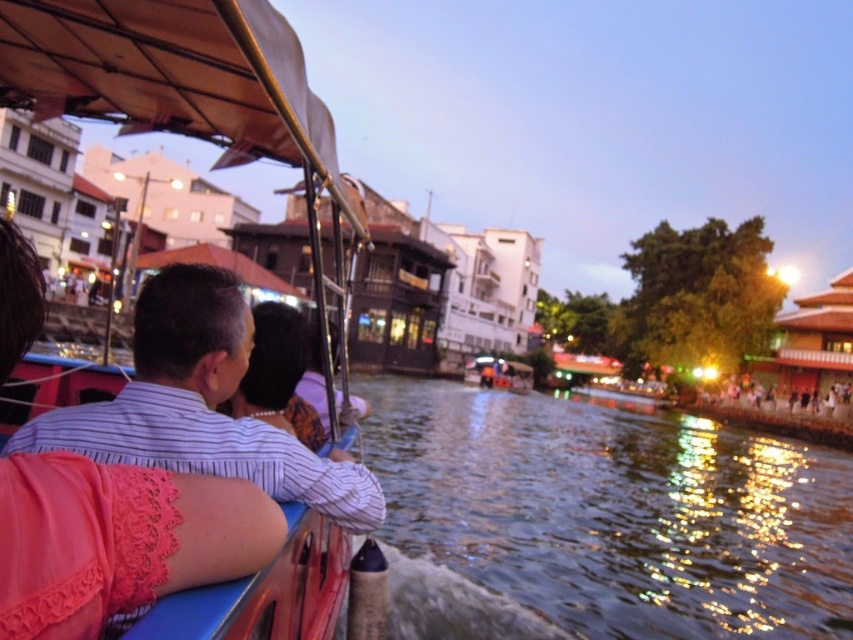
Who is positioned more to the right, wooden boat at center or striped fabric shirt at center?

wooden boat at center

Can you confirm if wooden boat at center is smaller than striped fabric shirt at center?

Indeed, wooden boat at center has a smaller size compared to striped fabric shirt at center.

Which is in front, point (175, 68) or point (248, 380)?

Positioned in front is point (248, 380).

Find the location of a particular element. wooden boat at center is located at coordinates (199, 81).

Image resolution: width=853 pixels, height=640 pixels. What do you see at coordinates (601, 520) in the screenshot? I see `dark water at center` at bounding box center [601, 520].

Is dark water at center further to the viewer compared to wooden boat at center?

No, it is in front of wooden boat at center.

Find the location of a particular element. dark water at center is located at coordinates (601, 520).

Does point (721, 616) come farther from viewer compared to point (746, 396)?

No, (721, 616) is in front of (746, 396).

Is dark water at center shorter than matte black boat at right?

In fact, dark water at center may be taller than matte black boat at right.

Is point (425, 563) in front of point (743, 404)?

Yes, it is.

At what (x,y) coordinates should I click in order to perform the action: click on dark water at center. Please return your answer as a coordinate pair (x, y). Image resolution: width=853 pixels, height=640 pixels. Looking at the image, I should click on (601, 520).